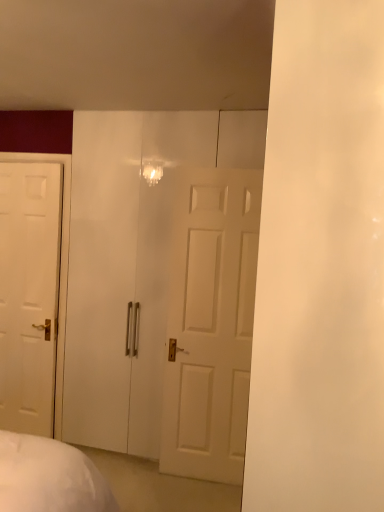
You are a GUI agent. You are given a task and a screenshot of the screen. Output one action in this format:
    pyautogui.click(x=<x>, y=<y>)
    Task: Click on the vacant region above transparent glass door at center (from a real-world perspective)
    
    Given the screenshot: What is the action you would take?
    pyautogui.click(x=166, y=110)